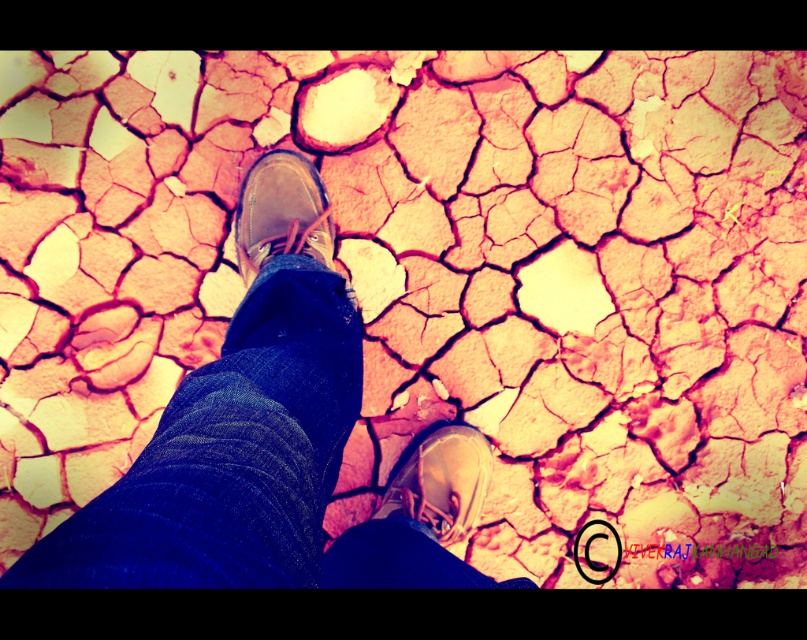
You are a photographer trying to capture the texture of the cracked ground. You notice two shoes, brown leather shoes at center and matte brown shoe at center, partially obscuring the ground. Which shoe should you move to get a clearer view of the ground texture?

You should move the brown leather shoes at center because it might be wider than the matte brown shoe at center, thus covering more of the ground and obstructing the view.

You are a photographer standing above the dry cracked ground and want to take a photo of the brown leather shoes at center. If your camera can focus on objects within 20 inches, will the shoes be in focus?

The brown leather shoes at center is 21.55 inches from the camera, which is beyond the 20 inches focus range, so the shoes will not be in focus.